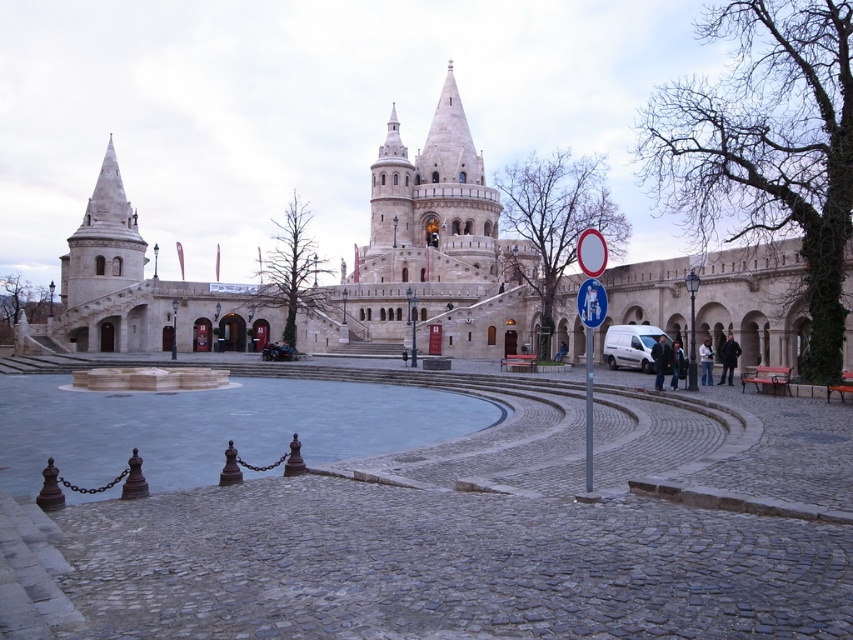
You are standing in the plaza in front of the castle. You see the white stone tower at left and the metallic street sign at center. Which object is higher from the ground?

The white stone tower at left is higher from the ground than the metallic street sign at center because it is positioned above it.

In the scene shown: You are a tourist standing in the plaza in front of the castle. You want to take a photo that includes both the white stone tower at left and the metallic street sign at center. Which object will appear larger in the photo?

The white stone tower at left will appear larger in the photo because it has a greater height compared to the metallic street sign at center.